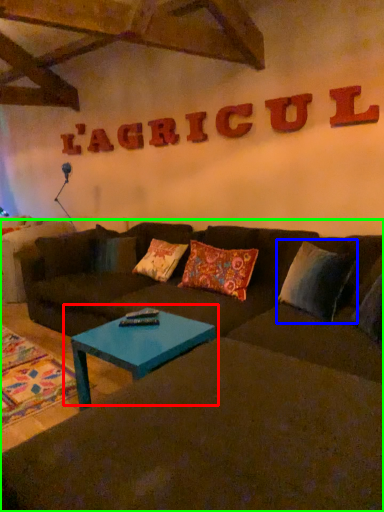
Question: Which object is positioned closest to coffee table (highlighted by a red box)? Select from pillow (highlighted by a blue box) and studio couch (highlighted by a green box).

Choices:
 (A) pillow
 (B) studio couch

Answer: (B)